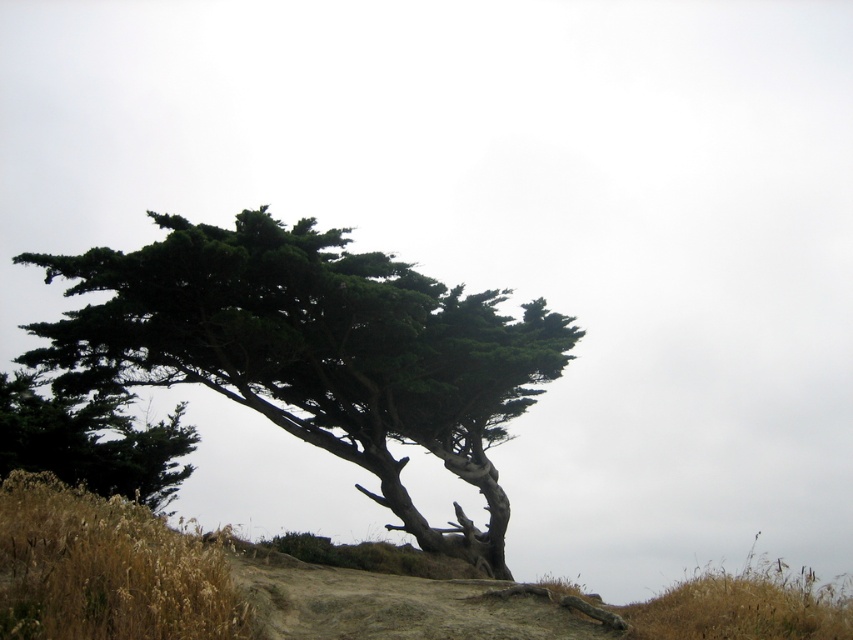
Where is `green leafy tree at center`? This screenshot has height=640, width=853. green leafy tree at center is located at coordinates (315, 349).

What do you see at coordinates (315, 349) in the screenshot?
I see `green leafy tree at center` at bounding box center [315, 349].

Find the location of a particular element. The height and width of the screenshot is (640, 853). green leafy tree at center is located at coordinates (315, 349).